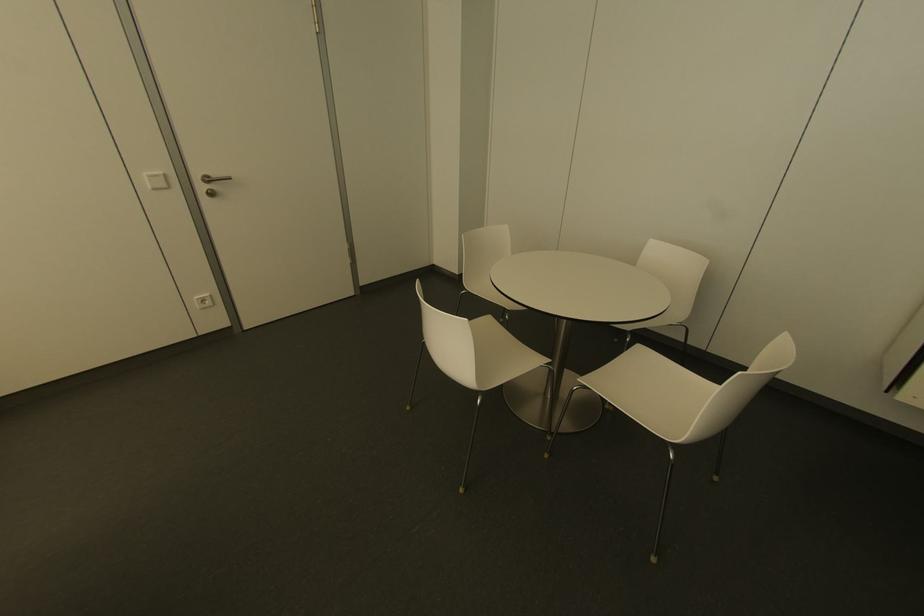
What are the coordinates of `silver door handle` in the screenshot? It's located at (213, 177).